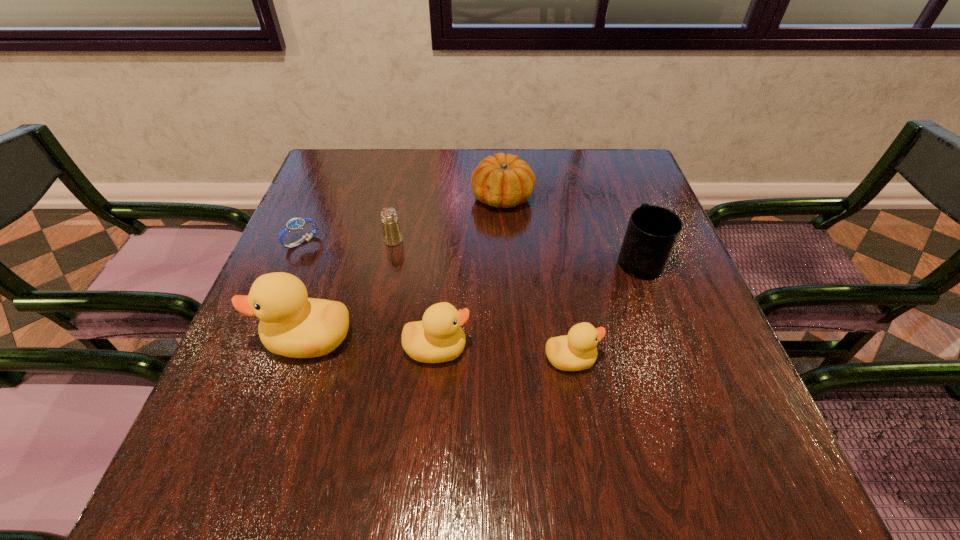
Where is `free region located on the back of the fifth object from right to left`? The height and width of the screenshot is (540, 960). free region located on the back of the fifth object from right to left is located at coordinates (406, 180).

Locate an element on the screen. This screenshot has width=960, height=540. vacant space located 0.390m on the left of the farthest object is located at coordinates (324, 197).

This screenshot has height=540, width=960. I want to click on vacant space located 0.400m on the side of the rightmost object with the handle, so click(x=600, y=152).

Identify the location of vacant area situated on the side of the rightmost object with the handle. The width and height of the screenshot is (960, 540). (604, 161).

Identify the location of free space located 0.280m on the side of the rightmost object with the handle. This screenshot has height=540, width=960. (609, 174).

You are a GUI agent. You are given a task and a screenshot of the screen. Output one action in this format:
    pyautogui.click(x=<x>, y=<y>)
    Task: Click on the free space located 0.380m on the right of the watch
    The height and width of the screenshot is (540, 960).
    Given the screenshot: What is the action you would take?
    pyautogui.click(x=478, y=242)

Identify the location of object that is at the far edge. The width and height of the screenshot is (960, 540). (501, 180).

Identify the location of duckling present at the left edge. (291, 324).

Identify the location of watch that is positioned at the left edge. (295, 224).

You are a GUI agent. You are given a task and a screenshot of the screen. Output one action in this format:
    pyautogui.click(x=<x>, y=<y>)
    Task: Click on the object that is at the right edge
    
    Given the screenshot: What is the action you would take?
    pyautogui.click(x=652, y=232)